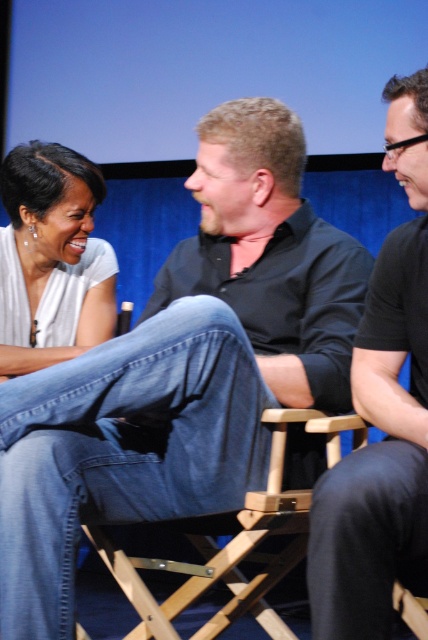
Based on the photo, you are standing in front of the scene and need to locate the white matte shirt at upper left. Based on the coordinates provided, is it closer to the top edge or the bottom edge of the image?

The white matte shirt at upper left is located at point (51, 253), which means it is closer to the top edge of the image since the y coordinate is 0.121, indicating proximity to the top.

From the picture: You are a photographer standing at the back of the room. You need to adjust the camera to capture both the black matte shirt at center and the third individual on the right side of the frame in the same shot. The minimum distance between the two subjects is 4.08 feet. What is the minimum focal length your camera should have to ensure both are in frame?

The minimum focal length required would depend on the sensor size of the camera and the desired field of view. However, since the subjects are 4.08 feet apart, a wider angle lens with a focal length of around 35mm or lower would likely capture both the black matte shirt at center and the third individual on the right side of the frame in the same shot.